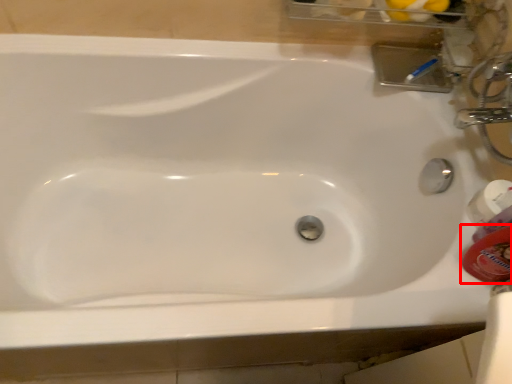
Question: Considering the relative positions of mouthwash (annotated by the red box) and mouthwash in the image provided, where is mouthwash (annotated by the red box) located with respect to the staircase?

Choices:
 (A) right
 (B) left

Answer: (B)